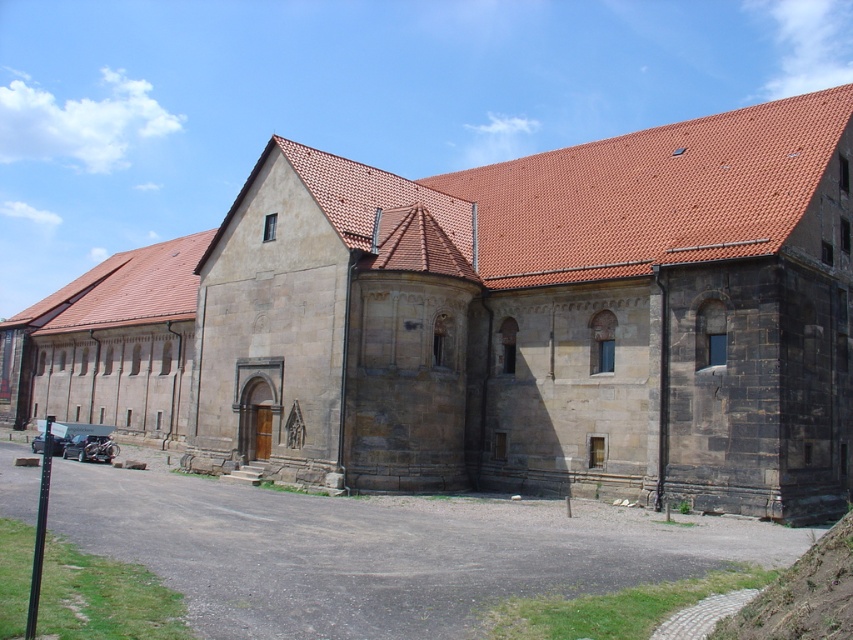
Question: Among these points, which one is nearest to the camera?

Choices:
 (A) (601, 292)
 (B) (798, 602)

Answer: (B)

Question: Can you confirm if stone chapel at center is thinner than green grassy hill at lower right?

Choices:
 (A) no
 (B) yes

Answer: (A)

Question: Which point is closer to the camera?

Choices:
 (A) stone chapel at center
 (B) green grassy hill at lower right

Answer: (B)

Question: Which point appears closest to the camera in this image?

Choices:
 (A) (849, 582)
 (B) (759, 460)

Answer: (A)

Question: Can you confirm if stone chapel at center is wider than green grassy hill at lower right?

Choices:
 (A) no
 (B) yes

Answer: (B)

Question: Is stone chapel at center positioned before green grassy hill at lower right?

Choices:
 (A) no
 (B) yes

Answer: (A)